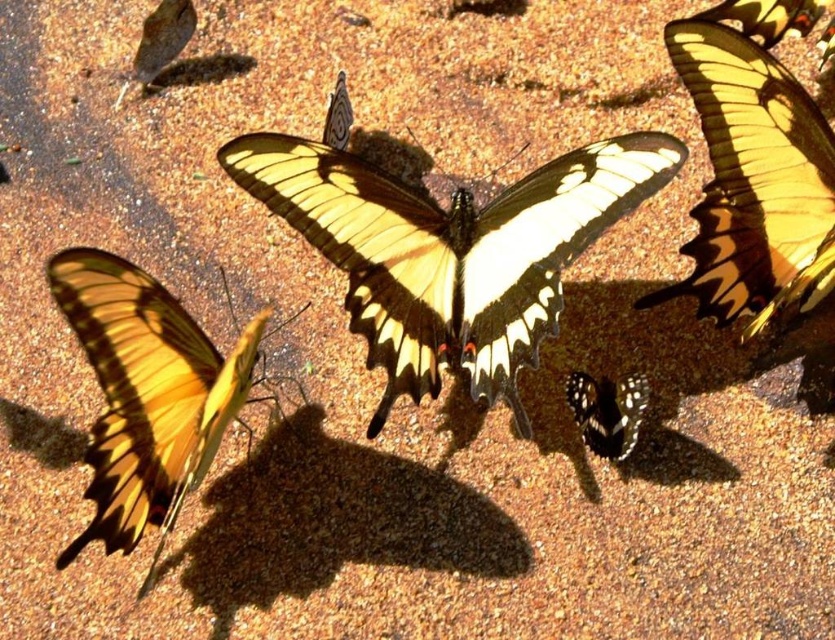
Who is more distant from viewer, (760, 179) or (150, 426)?

The point (760, 179) is more distant.

Locate an element on the screen. yellow and black winged butterfly at upper right is located at coordinates (753, 180).

Which is in front, point (750, 61) or point (815, 17)?

Point (750, 61) is in front.

Is the position of yellow and black winged butterfly at upper right less distant than that of yellow/golden textured wings at upper right?

That is True.

Find the location of a particular element. The image size is (835, 640). yellow and black winged butterfly at upper right is located at coordinates [753, 180].

Which is more to the right, yellow and black butterfly at center or yellow and black winged butterfly at upper right?

yellow and black winged butterfly at upper right is more to the right.

Does point (315, 176) come farther from viewer compared to point (736, 108)?

Yes, it is behind point (736, 108).

Between point (668, 141) and point (689, 65), which one is positioned behind?

The point (689, 65) is more distant.

You are a GUI agent. You are given a task and a screenshot of the screen. Output one action in this format:
    pyautogui.click(x=<x>, y=<y>)
    Task: Click on the yellow and black butterfly at center
    This screenshot has width=835, height=640.
    Given the screenshot: What is the action you would take?
    pyautogui.click(x=448, y=248)